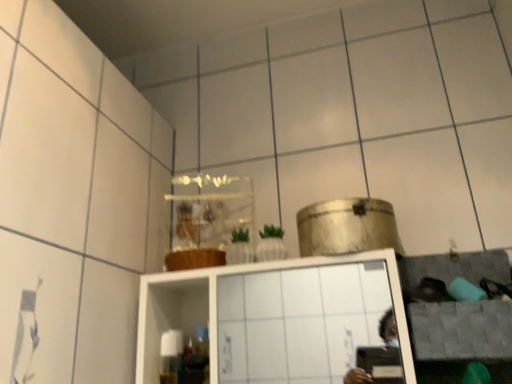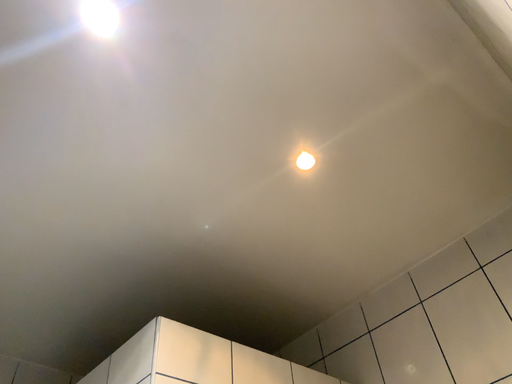
Question: How did the camera likely rotate when shooting the video?

Choices:
 (A) rotated left
 (B) rotated right

Answer: (A)